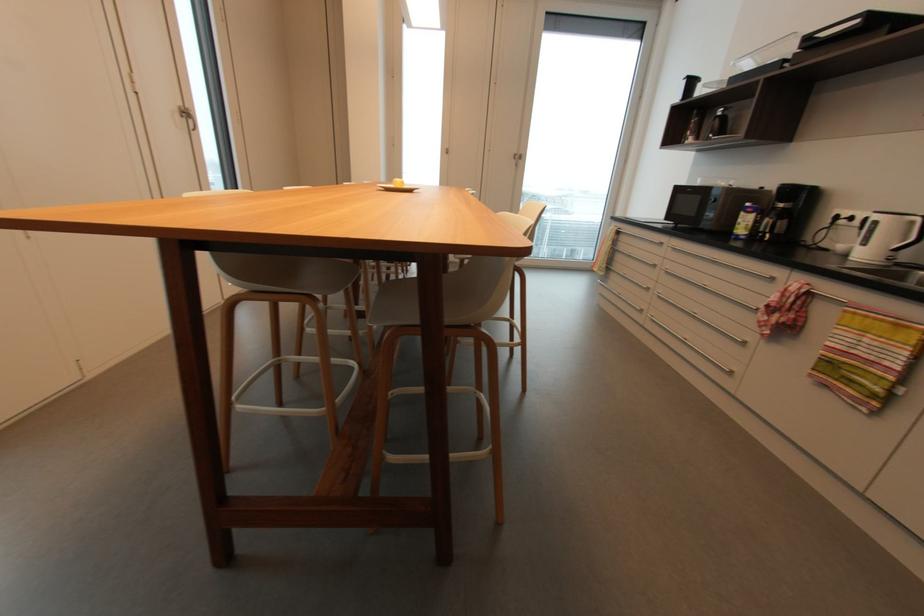
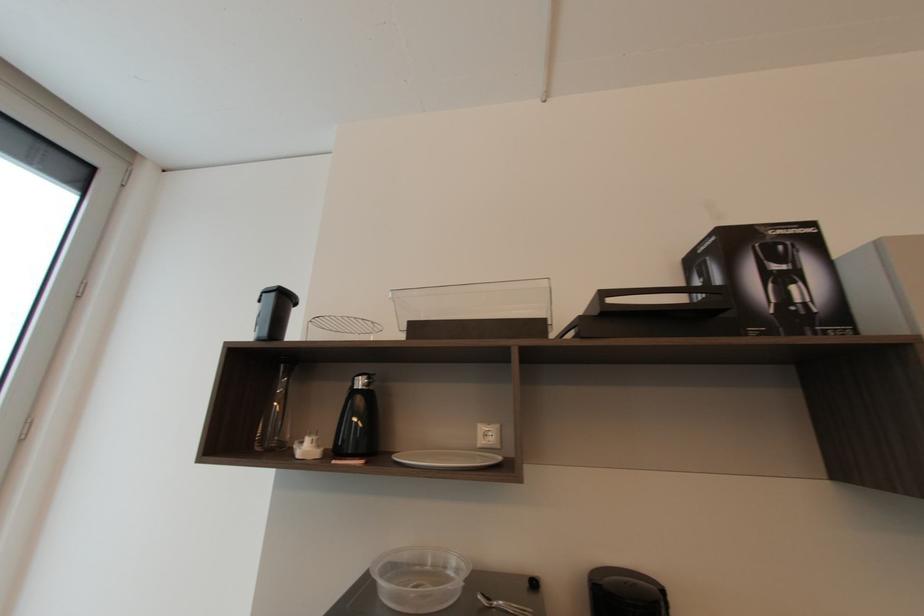
The point at (723, 113) is marked in the first image. Where is the corresponding point in the second image?

(362, 384)